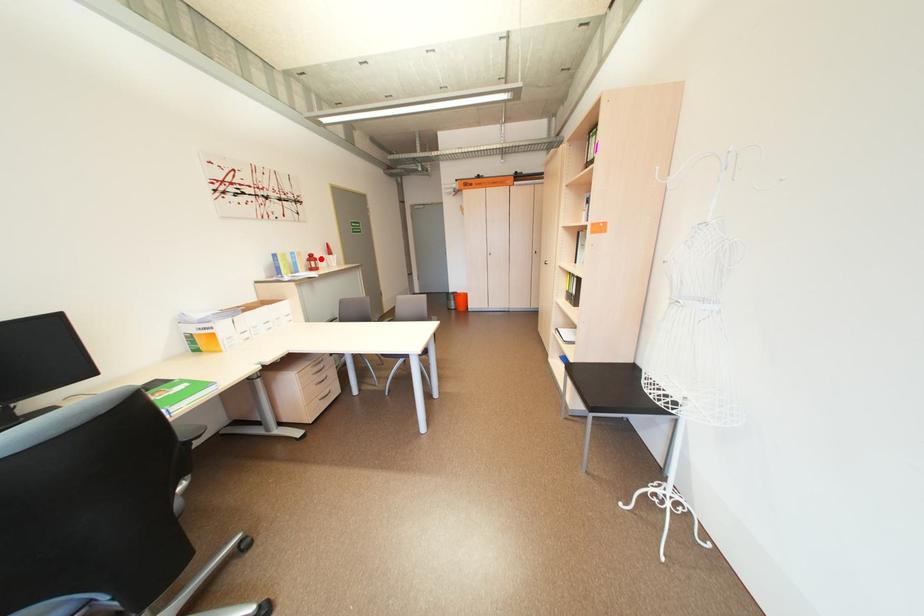
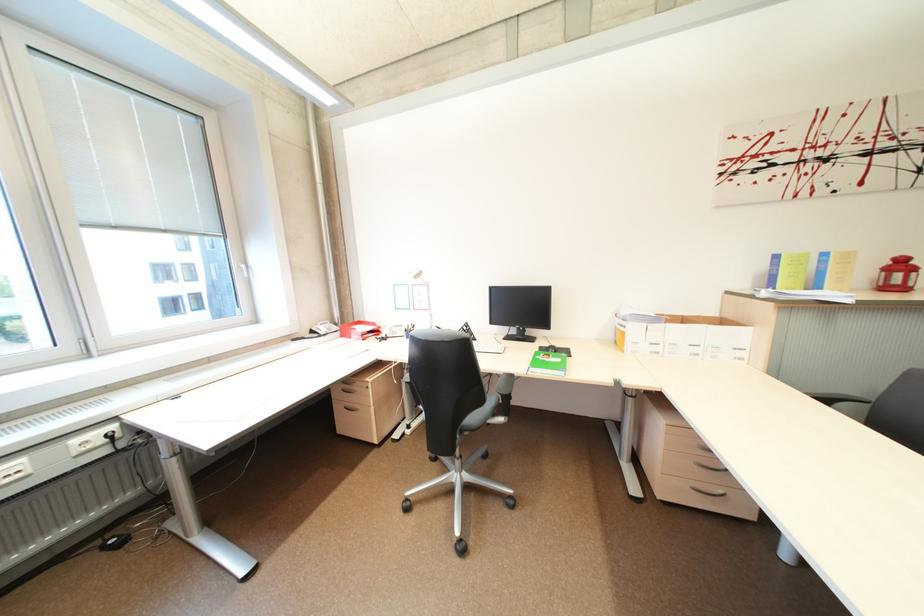
Question: A red point is marked in image1. In image2, is the corresponding 3D point closer to the camera or farther? Reply with the corresponding letter.

Choices:
 (A) The corresponding 3D point is closer.
 (B) The corresponding 3D point is farther.

Answer: (B)